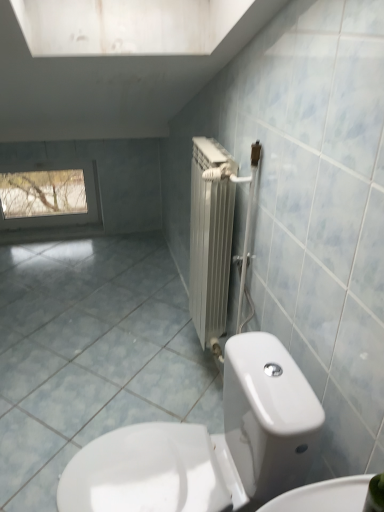
In the scene shown: In order to face blue glossy tile at center, should I rotate leftwards or rightwards?

Turn left approximately 13.650 degrees to face it.

Where is `white glossy toilet at lower center`? The width and height of the screenshot is (384, 512). white glossy toilet at lower center is located at coordinates (208, 444).

What do you see at coordinates (52, 198) in the screenshot? I see `clear glass window at upper left` at bounding box center [52, 198].

Locate an element on the screen. The height and width of the screenshot is (512, 384). blue glossy tile at center is located at coordinates (91, 355).

Can we say white glossy toilet at lower center lies outside blue glossy tile at center?

Yes, white glossy toilet at lower center is outside of blue glossy tile at center.

Between white glossy toilet at lower center and blue glossy tile at center, which one has less height?

blue glossy tile at center.

Considering the points (160, 422) and (185, 368), which point is in front, point (160, 422) or point (185, 368)?

The point (160, 422) is closer.

At what (x,y) coordinates should I click in order to perform the action: click on ceramic tile beneath the clear glass window at upper left (from a real-world perspective). Please return your answer as a coordinate pair (x, y). Looking at the image, I should click on [91, 355].

Can you confirm if blue glossy tile at center is bigger than clear glass window at upper left?

Yes, blue glossy tile at center is bigger than clear glass window at upper left.

Is point (127, 266) closer to camera compared to point (10, 225)?

Yes, point (127, 266) is in front of point (10, 225).

Measure the distance between white glossy toilet at lower center and clear glass window at upper left.

white glossy toilet at lower center and clear glass window at upper left are 2.53 meters apart from each other.

From a real-world perspective, is white glossy toilet at lower center located higher than clear glass window at upper left?

Yes, from a real-world perspective, white glossy toilet at lower center is above clear glass window at upper left.

Can you tell me how much white glossy toilet at lower center and clear glass window at upper left differ in facing direction?

The angular difference between white glossy toilet at lower center and clear glass window at upper left is 89.4 degrees.

Are white glossy toilet at lower center and clear glass window at upper left far apart?

white glossy toilet at lower center is positioned a significant distance from clear glass window at upper left.

Consider the image. Is blue glossy tile at center oriented towards white glossy toilet at lower center?

Yes, blue glossy tile at center is aimed at white glossy toilet at lower center.

From a real-world perspective, which object stands above the other?

In real-world perspective, white glossy toilet at lower center is above.

Would you say blue glossy tile at center is inside or outside white glossy toilet at lower center?

blue glossy tile at center exists outside the volume of white glossy toilet at lower center.

Are blue glossy tile at center and white glossy toilet at lower center far apart?

That's not correct — blue glossy tile at center is a little close to white glossy toilet at lower center.

Could you tell me if clear glass window at upper left is facing blue glossy tile at center?

Yes, clear glass window at upper left is turned towards blue glossy tile at center.

Would you say clear glass window at upper left is to the left or to the right of blue glossy tile at center in the picture?

In the image, clear glass window at upper left appears on the left side of blue glossy tile at center.

Locate an element on the screen. The height and width of the screenshot is (512, 384). ceramic tile on the right of clear glass window at upper left is located at coordinates (91, 355).

Between clear glass window at upper left and blue glossy tile at center, which one has smaller width?

clear glass window at upper left is thinner.

From the image's perspective, does clear glass window at upper left appear lower than white glossy toilet at lower center?

No.

At what (x,y) coordinates should I click in order to perform the action: click on toilet in front of the clear glass window at upper left. Please return your answer as a coordinate pair (x, y). Looking at the image, I should click on 208,444.

From a real-world perspective, which object stands above the other?

From a 3D spatial view, white glossy toilet at lower center is above.

Where is `toilet above the blue glossy tile at center (from a real-world perspective)`? The width and height of the screenshot is (384, 512). toilet above the blue glossy tile at center (from a real-world perspective) is located at coordinates (208, 444).

Locate an element on the screen. The image size is (384, 512). window behind the blue glossy tile at center is located at coordinates (52, 198).

Looking at the image, which one is located closer to clear glass window at upper left, white glossy toilet at lower center or blue glossy tile at center?

blue glossy tile at center is closer to clear glass window at upper left.

Which object lies further to the anchor point blue glossy tile at center, clear glass window at upper left or white glossy toilet at lower center?

Based on the image, clear glass window at upper left appears to be further to blue glossy tile at center.

From the image, which object appears to be farther from white glossy toilet at lower center, blue glossy tile at center or clear glass window at upper left?

Among the two, clear glass window at upper left is located further to white glossy toilet at lower center.

Looking at the image, which one is located further to white glossy toilet at lower center, clear glass window at upper left or blue glossy tile at center?

The object further to white glossy toilet at lower center is clear glass window at upper left.

Looking at the image, which one is located further to blue glossy tile at center, white glossy toilet at lower center or clear glass window at upper left?

clear glass window at upper left is positioned further to the anchor blue glossy tile at center.

Estimate the real-world distances between objects in this image. Which object is closer to clear glass window at upper left, blue glossy tile at center or white glossy toilet at lower center?

blue glossy tile at center lies closer to clear glass window at upper left than the other object.

Locate an element on the screen. This screenshot has height=512, width=384. ceramic tile between white glossy toilet at lower center and clear glass window at upper left in the front-back direction is located at coordinates (91, 355).